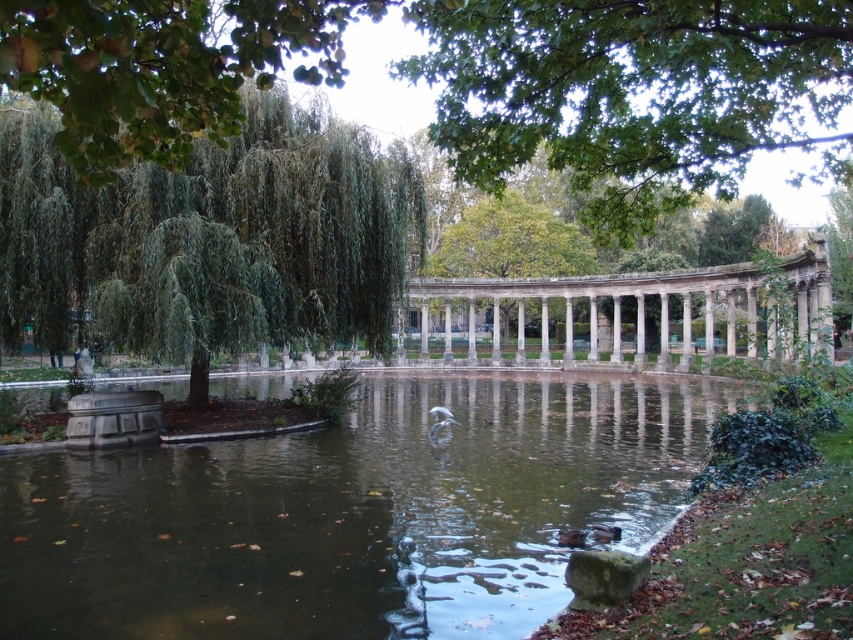
Does green leafy tree at upper center have a lesser height compared to green leafy tree at center?

No.

Is green leafy tree at upper center above green leafy tree at center?

Yes.

Between point (701, 76) and point (457, 228), which one is positioned in front?

Positioned in front is point (701, 76).

Image resolution: width=853 pixels, height=640 pixels. I want to click on green leafy tree at upper center, so click(x=633, y=92).

Does clear water at center have a lesser width compared to green leafy tree at upper center?

No.

Can you confirm if clear water at center is wider than green leafy tree at upper center?

Yes.

This screenshot has width=853, height=640. What do you see at coordinates (352, 513) in the screenshot?
I see `clear water at center` at bounding box center [352, 513].

Where is `clear water at center`? This screenshot has height=640, width=853. clear water at center is located at coordinates (352, 513).

Based on the photo, does clear water at center appear under green leafy tree at center?

Indeed, clear water at center is positioned under green leafy tree at center.

Which is in front, point (556, 403) or point (502, 198)?

Point (556, 403) is in front.

This screenshot has height=640, width=853. In order to click on clear water at center in this screenshot , I will do `click(352, 513)`.